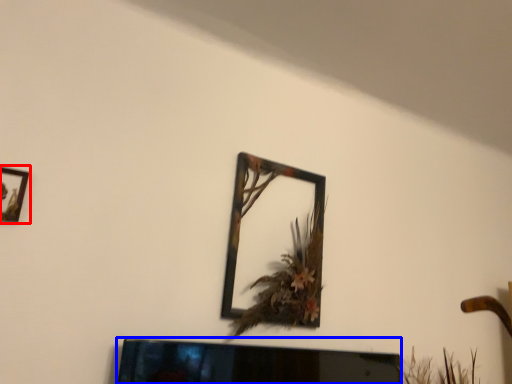
Question: Which object appears farthest to the camera in this image, picture frame (highlighted by a red box) or television (highlighted by a blue box)?

Choices:
 (A) picture frame
 (B) television

Answer: (B)